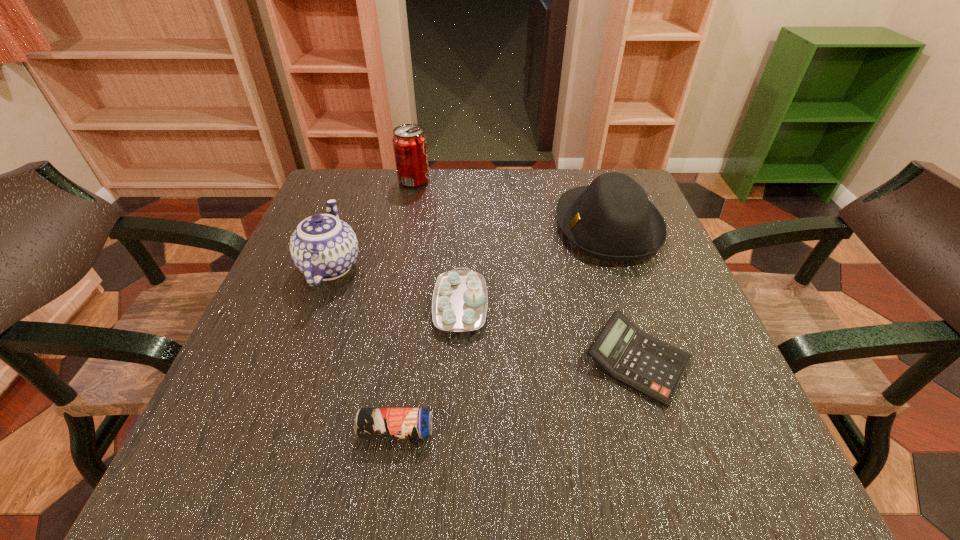
Find the location of a particular element. This screenshot has height=540, width=960. free space located at the spout of the left chinaware is located at coordinates (363, 180).

You are a GUI agent. You are given a task and a screenshot of the screen. Output one action in this format:
    pyautogui.click(x=<x>, y=<y>)
    Task: Click on the free space located 0.210m at the spout of the left chinaware
    This screenshot has height=540, width=960.
    Given the screenshot: What is the action you would take?
    pyautogui.click(x=361, y=186)

Locate an element on the screen. The width and height of the screenshot is (960, 540). vacant space located on the front-facing side of the fedora is located at coordinates (458, 226).

Identify the location of vacant space located 0.250m on the front-facing side of the fedora. This screenshot has height=540, width=960. (449, 226).

Identify the location of free point located on the front-facing side of the fedora. This screenshot has height=540, width=960. (402, 226).

This screenshot has height=540, width=960. Find the location of `vacant space positioned 0.090m on the right of the right chinaware`. vacant space positioned 0.090m on the right of the right chinaware is located at coordinates (534, 305).

The image size is (960, 540). I want to click on free space located 0.130m on the back of the beer can, so click(408, 349).

Locate an element on the screen. The image size is (960, 540). vacant space located 0.330m on the left of the calculator is located at coordinates (391, 361).

Locate an element on the screen. Image resolution: width=960 pixels, height=540 pixels. pop soda present at the far edge is located at coordinates (409, 141).

Locate an element on the screen. The height and width of the screenshot is (540, 960). fedora present at the far edge is located at coordinates (612, 219).